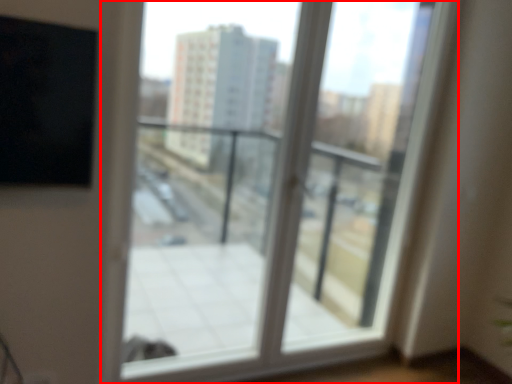
Question: From the image, what is the correct spatial relationship of window (annotated by the red box) in relation to screen door?

Choices:
 (A) right
 (B) left

Answer: (B)